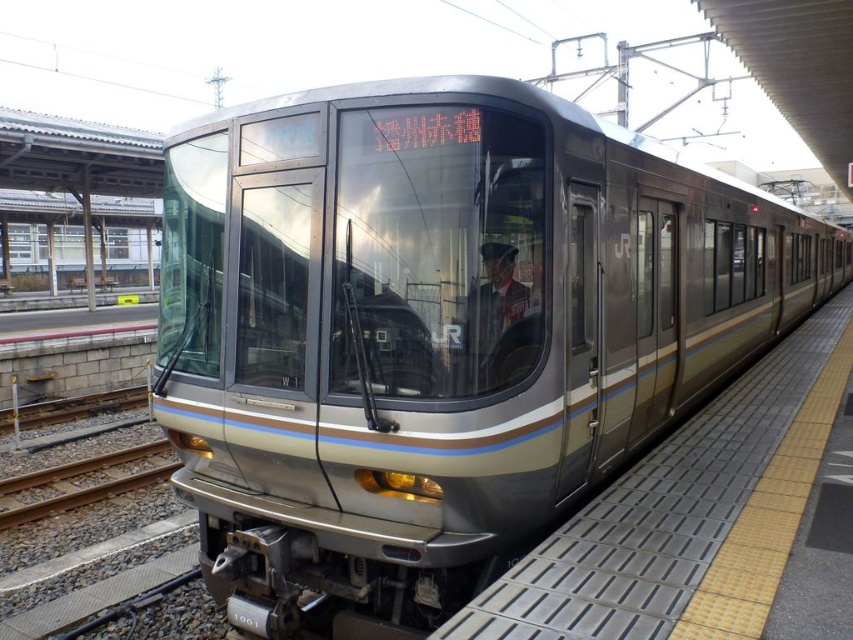
Question: Which object appears closest to the camera in this image?

Choices:
 (A) metallic gray platform at center
 (B) uniformed person at center
 (C) metallic silver train at center

Answer: (A)

Question: Does metallic gray platform at center appear on the left side of uniformed person at center?

Choices:
 (A) yes
 (B) no

Answer: (B)

Question: Is metallic gray platform at center bigger than uniformed person at center?

Choices:
 (A) yes
 (B) no

Answer: (A)

Question: Based on their relative distances, which object is nearer to the metallic silver train at center?

Choices:
 (A) metallic gray platform at center
 (B) uniformed person at center

Answer: (A)

Question: Does metallic gray platform at center have a smaller size compared to uniformed person at center?

Choices:
 (A) no
 (B) yes

Answer: (A)

Question: Which of the following is the farthest from the observer?

Choices:
 (A) (323, 589)
 (B) (664, 509)

Answer: (B)